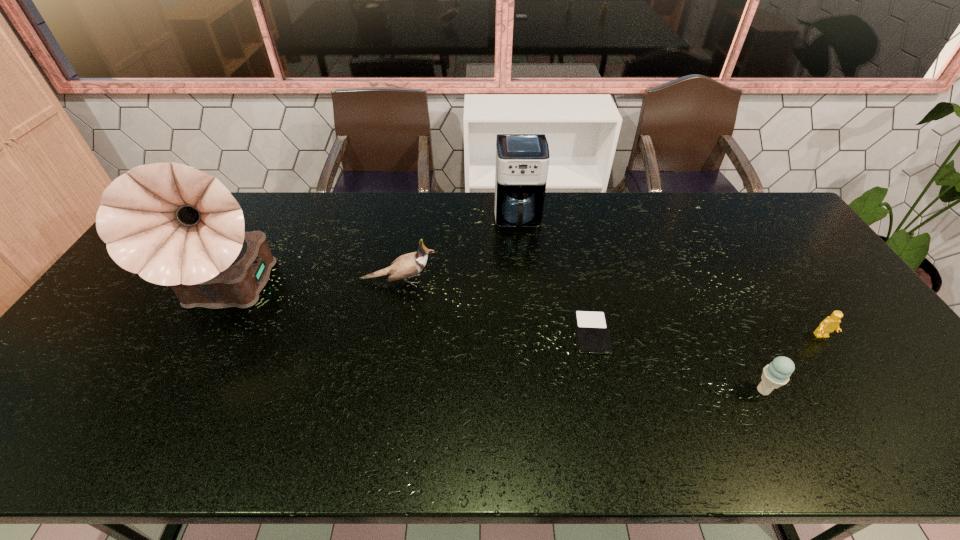
Find the location of a particular element. The image size is (960, 540). iPod is located at coordinates (592, 331).

The height and width of the screenshot is (540, 960). Identify the location of the fourth object from left to right. (592, 331).

Find the location of a particular element. This screenshot has height=540, width=960. free space located 0.200m from the horn of the record player is located at coordinates (165, 415).

This screenshot has height=540, width=960. I want to click on free location located 0.330m on the front panel of the fourth object from right to left, so click(527, 318).

The width and height of the screenshot is (960, 540). Identify the location of vacant space positioned 0.050m at the face of the fifth object from right to left. (454, 281).

Find the location of a particular element. The width and height of the screenshot is (960, 540). vacant space located 0.330m on the left of the third shortest object is located at coordinates (614, 390).

Where is `free space located 0.090m on the face of the rightmost object`? The image size is (960, 540). free space located 0.090m on the face of the rightmost object is located at coordinates (845, 370).

Locate an element on the screen. vacant space located 0.160m on the back of the iPod is located at coordinates (578, 272).

I want to click on object that is at the far edge, so click(x=522, y=160).

Find the location of `object that is at the right edge`. object that is at the right edge is located at coordinates (831, 323).